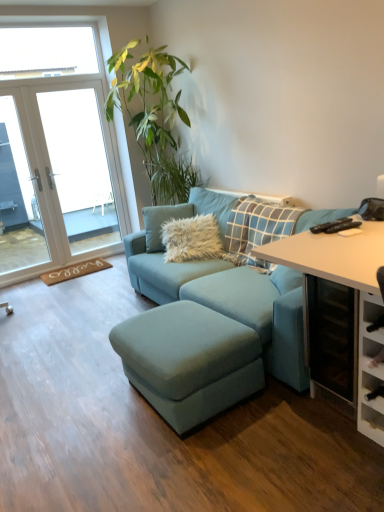
Locate an element on the screen. free point in front of suede blue footrest at center is located at coordinates (198, 462).